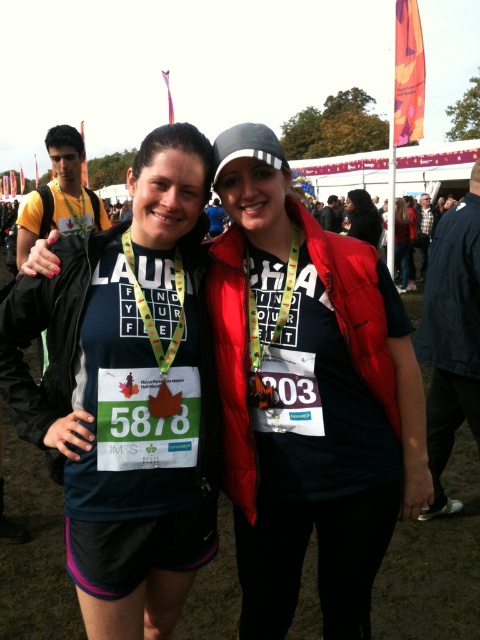
Question: Does matte black vest at center appear on the left side of matte black jacket at center?

Choices:
 (A) yes
 (B) no

Answer: (A)

Question: Based on their relative distances, which object is nearer to the matte black t-shirt at center?

Choices:
 (A) yellow matte t-shirt at left
 (B) dark blue fabric jacket at lower right

Answer: (B)

Question: Observing the image, what is the correct spatial positioning of matte black vest at center in reference to matte black jacket at center?

Choices:
 (A) below
 (B) above

Answer: (A)

Question: Considering the relative positions of matte black vest at center and yellow matte t-shirt at left in the image provided, where is matte black vest at center located with respect to yellow matte t-shirt at left?

Choices:
 (A) left
 (B) right

Answer: (B)

Question: Which of the following is the farthest from the observer?

Choices:
 (A) matte black jacket at center
 (B) dark gray fabric jacket at center
 (C) black matte vest at center

Answer: (B)

Question: Which point is closer to the camera taking this photo?

Choices:
 (A) (275, 497)
 (B) (466, 378)
 (C) (334, 198)
 (D) (355, 224)

Answer: (A)